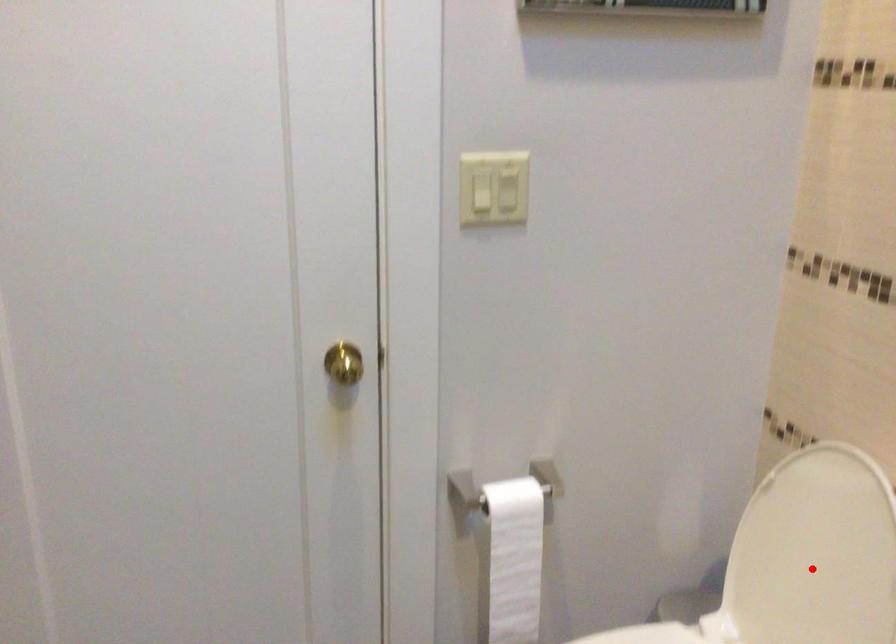
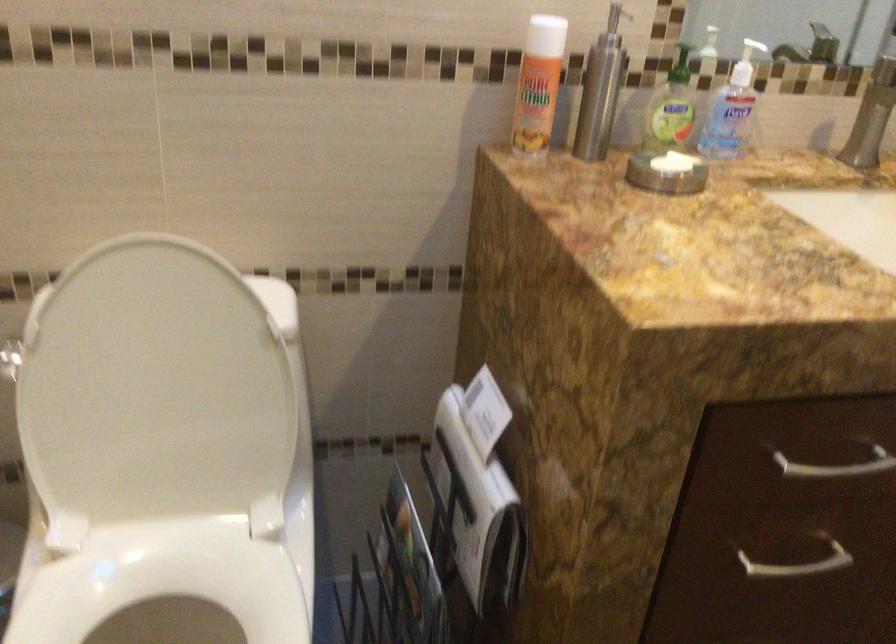
Question: I am providing you with two images of the same scene from different viewpoints. Given a red point in image1, look at the same physical point in image2. Is it:

Choices:
 (A) Closer to the viewpoint
 (B) Farther from the viewpoint

Answer: (A)